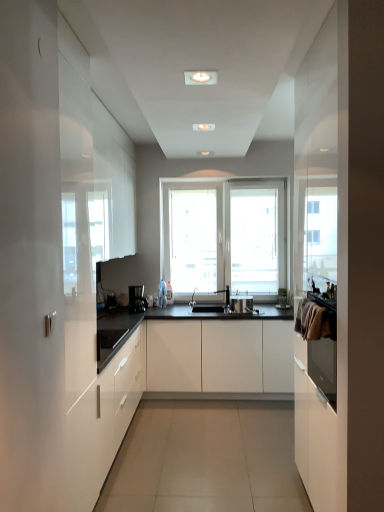
Question: Would you consider satin silver toaster at center to be distant from white matte cabinet at center, which is the second cabinetry in left-to-right order?

Choices:
 (A) yes
 (B) no

Answer: (B)

Question: Considering the relative sizes of satin silver toaster at center and white matte cabinet at center, which is the second cabinetry in left-to-right order, in the image provided, is satin silver toaster at center wider than white matte cabinet at center, which is the second cabinetry in left-to-right order,?

Choices:
 (A) no
 (B) yes

Answer: (A)

Question: Considering the relative positions of satin silver toaster at center and white matte cabinet at center, which is the second cabinetry in left-to-right order, in the image provided, is satin silver toaster at center behind white matte cabinet at center, which is the second cabinetry in left-to-right order,?

Choices:
 (A) no
 (B) yes

Answer: (B)

Question: Considering the relative sizes of satin silver toaster at center and white matte cabinet at center, which is the first cabinetry in right-to-left order, in the image provided, is satin silver toaster at center smaller than white matte cabinet at center, which is the first cabinetry in right-to-left order,?

Choices:
 (A) no
 (B) yes

Answer: (B)

Question: Would you say white matte cabinet at center, which is the second cabinetry in left-to-right order, is part of satin silver toaster at center's contents?

Choices:
 (A) yes
 (B) no

Answer: (B)

Question: From the image's perspective, is satin silver toaster at center beneath white matte cabinet at center, which is the first cabinetry in right-to-left order?

Choices:
 (A) no
 (B) yes

Answer: (A)

Question: From a real-world perspective, is black plastic coffee machine at center physically below satin silver toaster at center?

Choices:
 (A) yes
 (B) no

Answer: (B)

Question: Considering the relative positions of black plastic coffee machine at center and satin silver toaster at center in the image provided, is black plastic coffee machine at center to the left of satin silver toaster at center from the viewer's perspective?

Choices:
 (A) no
 (B) yes

Answer: (B)

Question: Is black plastic coffee machine at center in contact with satin silver toaster at center?

Choices:
 (A) no
 (B) yes

Answer: (A)

Question: From the image's perspective, is black plastic coffee machine at center above satin silver toaster at center?

Choices:
 (A) no
 (B) yes

Answer: (B)

Question: Considering the relative positions of black plastic coffee machine at center and satin silver toaster at center in the image provided, is black plastic coffee machine at center behind satin silver toaster at center?

Choices:
 (A) yes
 (B) no

Answer: (A)

Question: Is black plastic coffee machine at center facing away from satin silver toaster at center?

Choices:
 (A) yes
 (B) no

Answer: (B)

Question: Is the surface of satin silver toaster at center in direct contact with white glossy cabinet at left, marked as the second cabinetry in a right-to-left arrangement?

Choices:
 (A) yes
 (B) no

Answer: (B)